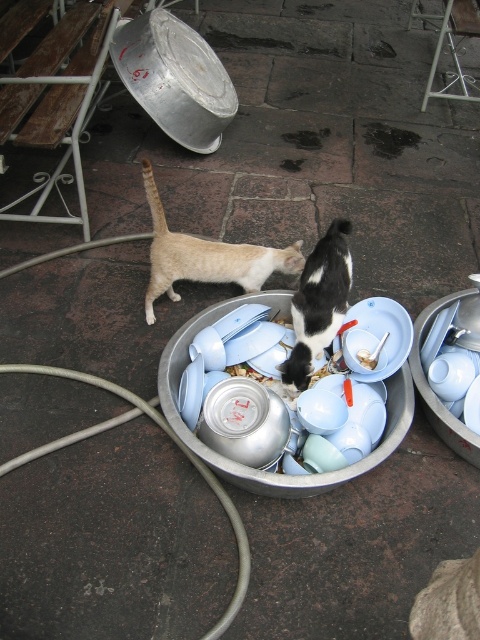
Question: Does light brown fur at center appear under black-and-white fur cat at center?

Choices:
 (A) no
 (B) yes

Answer: (A)

Question: Which is farther from the orange plastic spoon at center?

Choices:
 (A) black-and-white fur cat at center
 (B) light brown fur at center

Answer: (B)

Question: Which of these objects is positioned closest to the light brown fur at center?

Choices:
 (A) black-and-white fur cat at center
 (B) orange plastic spoon at center

Answer: (A)

Question: Which object is closer to the camera taking this photo?

Choices:
 (A) black-and-white fur cat at center
 (B) orange plastic spoon at center

Answer: (A)

Question: Is light brown fur at center positioned before black-and-white fur cat at center?

Choices:
 (A) yes
 (B) no

Answer: (B)

Question: Can you confirm if light brown fur at center is positioned to the left of orange plastic spoon at center?

Choices:
 (A) no
 (B) yes

Answer: (B)